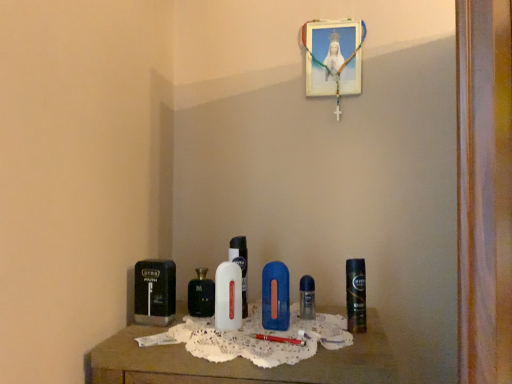
Locate an element on the screen. Image resolution: width=512 pixels, height=384 pixels. spots to the right of matte black perfume at center, which is the 1th perfume from left to right is located at coordinates (265, 326).